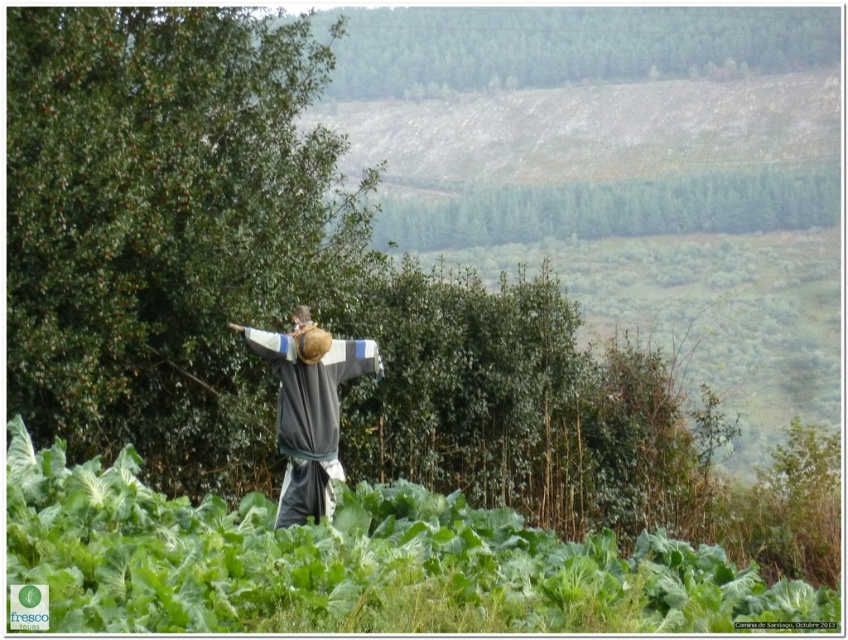
Question: Is green leafy tree at upper center to the left of green leafy tree at center from the viewer's perspective?

Choices:
 (A) yes
 (B) no

Answer: (A)

Question: Does green leafy tree at upper center appear over green leafy tree at center?

Choices:
 (A) yes
 (B) no

Answer: (A)

Question: Among these objects, which one is nearest to the camera?

Choices:
 (A) green leafy tree at center
 (B) gray fabric scarecrow at center
 (C) green leafy tree at upper center
 (D) green leafy tree at left

Answer: (B)

Question: Does green leafy tree at left have a larger size compared to gray fabric scarecrow at center?

Choices:
 (A) no
 (B) yes

Answer: (B)

Question: Among these objects, which one is farthest from the camera?

Choices:
 (A) green leafy tree at upper center
 (B) green leafy tree at left
 (C) green leafy tree at center
 (D) gray fabric scarecrow at center

Answer: (A)

Question: Which point is farther to the camera?

Choices:
 (A) (827, 205)
 (B) (283, 435)
 (C) (26, 209)
 (D) (439, 58)

Answer: (D)